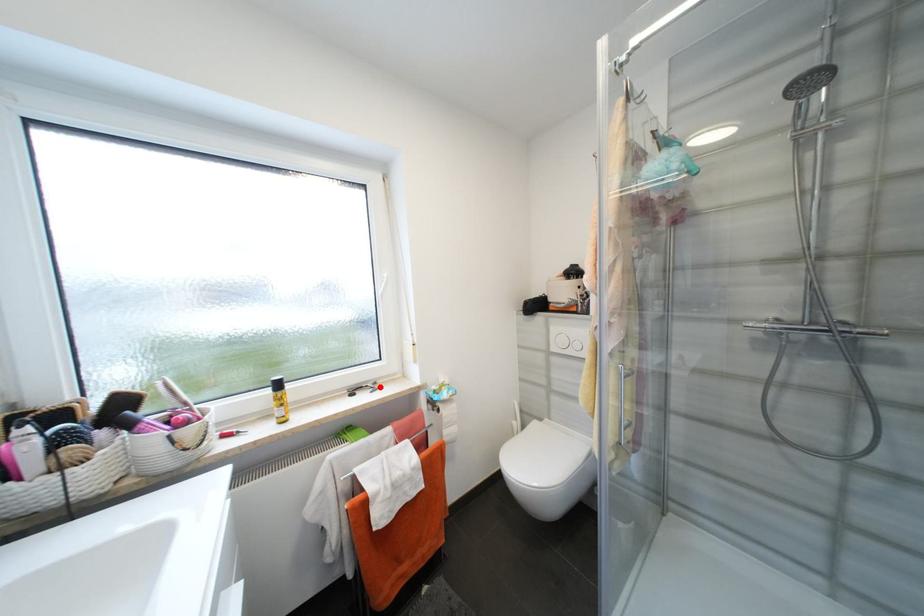
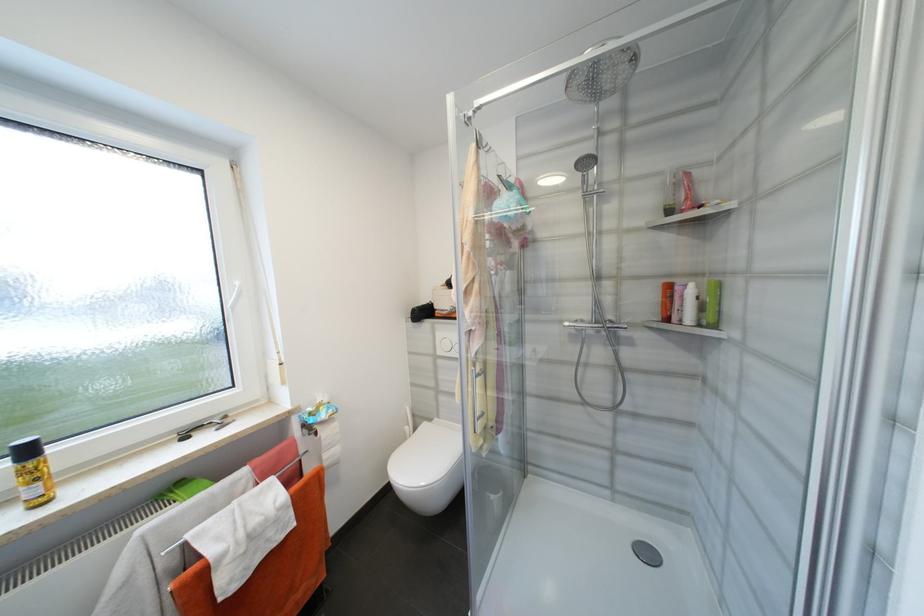
In the second image, find the point that corresponds to the highlighted location in the first image.

(228, 422)